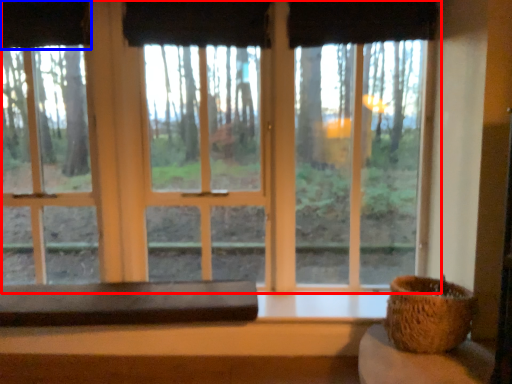
Question: Which of the following is the closest to the observer, window (highlighted by a red box) or curtain (highlighted by a blue box)?

Choices:
 (A) window
 (B) curtain

Answer: (A)